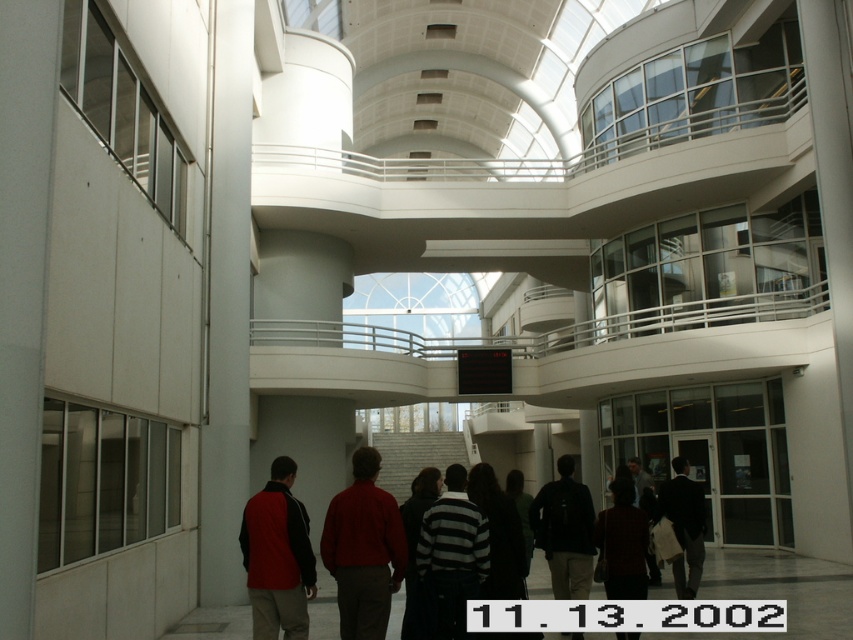
You are trying to decide which item to take from the center of the scene to stay warm. If both the red matte jacket at center and the dark red sweater at center are available, which one is narrower and thus easier to carry through narrow corridors?

The red matte jacket at center has a lesser width compared to the dark red sweater at center, so it is narrower and easier to carry through narrow corridors.

You are a security guard in the building and need to check on two people wearing a dark red sweater at center and a dark brown leather jacket at center. How far apart are these two individuals?

The distance between the dark red sweater at center and the dark brown leather jacket at center is 10.63 feet.

Looking at this image, you are standing in the atrium and want to ask someone about the digital clock on the upper level. Which clothing item should you approach first if you see the dark red sweater at center and dark brown leather jacket at center ahead of you?

You should approach the dark red sweater at center first because it is to the left of the dark brown leather jacket at center, meaning it is closer to your current position if you are facing them directly.